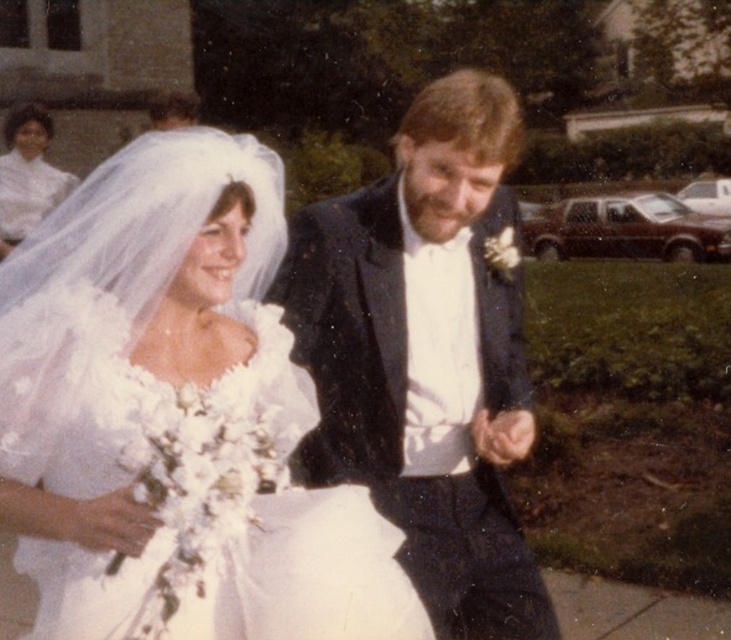
You are a photographer at the wedding and need to adjust the lighting to ensure both the shiny black tuxedo at center and the white satin dress at upper left are well lit. Since the tuxedo is smaller in size, which object might require more focused lighting adjustments to ensure proper exposure?

The shiny black tuxedo at center requires more focused lighting adjustments because it has a smaller size compared to the white satin dress at upper left, making it potentially harder to capture details in the limited space.

You are a photographer at the wedding and need to adjust the lighting to highlight the white satin dress at center. Since the dress is at point 0.653 on the x axis and 0.241 on the y axis, where exactly should you position the light to ensure it illuminates the dress properly?

The white satin dress at center is located at coordinates 0.653 on the x axis and 0.241 on the y axis. To properly illuminate it, the light should be positioned directly in front of the dress at those coordinates.